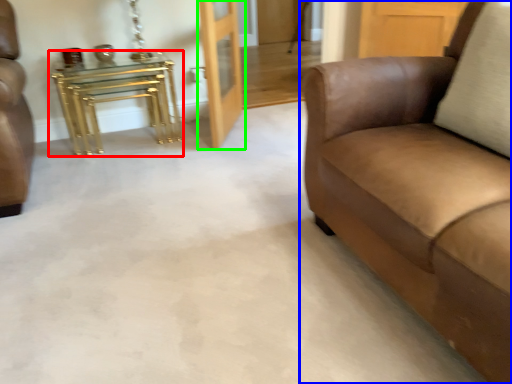
Question: Which object is the closest to the table (highlighted by a red box)? Choose among these: studio couch (highlighted by a blue box) or door (highlighted by a green box).

Choices:
 (A) studio couch
 (B) door

Answer: (B)